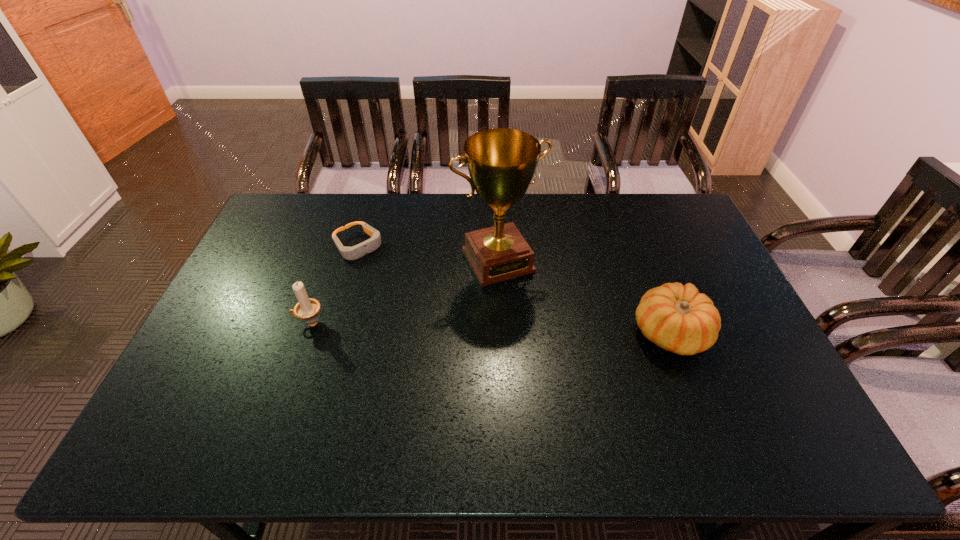
Image resolution: width=960 pixels, height=540 pixels. Find the location of `vacant space located 0.060m on the front and back of the shortest object`. vacant space located 0.060m on the front and back of the shortest object is located at coordinates (380, 267).

Find the location of `free location located on the front and back of the shortest object`. free location located on the front and back of the shortest object is located at coordinates (398, 286).

Identify the location of vacant space located 0.300m on the front and back of the shortest object. (422, 310).

Locate an element on the screen. This screenshot has width=960, height=540. vacant space located 0.330m on the plaque of the award is located at coordinates (564, 370).

This screenshot has width=960, height=540. I want to click on free space located 0.360m on the plaque of the award, so click(569, 380).

The image size is (960, 540). Identify the location of free location located on the plaque of the award. (526, 306).

Where is `object that is at the far edge`? This screenshot has height=540, width=960. object that is at the far edge is located at coordinates (349, 253).

The width and height of the screenshot is (960, 540). I want to click on object located in the right edge section of the desktop, so click(677, 318).

This screenshot has height=540, width=960. In the image, there is a desktop. Identify the location of vacant space at the far edge. (588, 200).

Where is `vacant region at the near edge of the desktop`? vacant region at the near edge of the desktop is located at coordinates (427, 385).